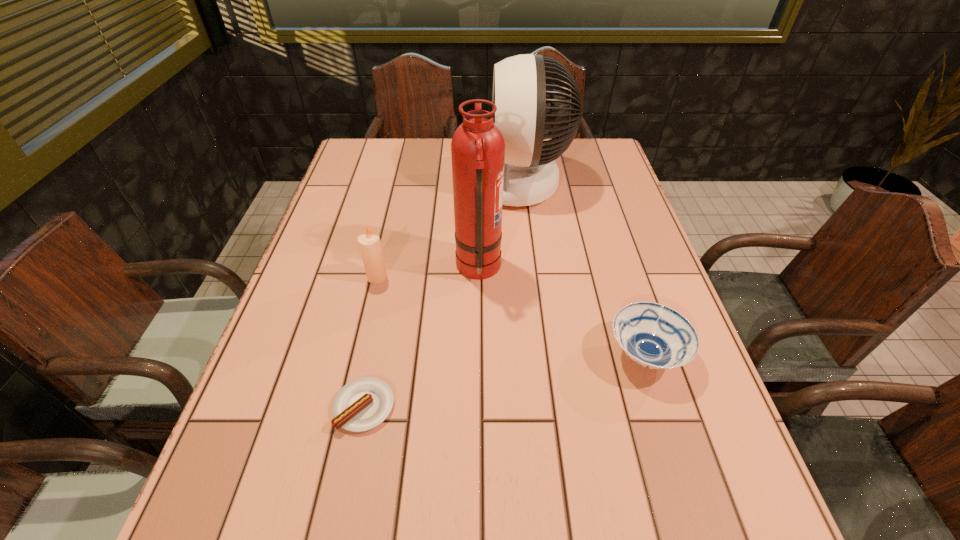
Locate an element on the screen. vacant space at the far right corner of the desktop is located at coordinates (622, 177).

Where is `vacant area that lies between the shortest object and the farthest object`? The image size is (960, 540). vacant area that lies between the shortest object and the farthest object is located at coordinates (442, 295).

I want to click on empty location between the farthest object and the shortest object, so click(442, 295).

Locate an element on the screen. free space between the sausage and the third shortest object is located at coordinates (371, 342).

Identify the location of vacant region between the soup bowl and the farthest object. The image size is (960, 540). (583, 269).

Find the location of a particular element. This screenshot has width=960, height=540. free space between the soup bowl and the farthest object is located at coordinates (583, 269).

Identify the location of blank region between the candle and the fire extinguisher. The width and height of the screenshot is (960, 540). (428, 273).

What are the coordinates of `free spot between the fan and the candle` in the screenshot? It's located at (448, 231).

Where is `object that is the nearest to the fan`? This screenshot has height=540, width=960. object that is the nearest to the fan is located at coordinates (478, 148).

Identify which object is the closest to the shortest object. Please provide its 2D coordinates. Your answer should be formatted as a tuple, i.e. [(x, y)], where the tuple contains the x and y coordinates of a point satisfying the conditions above.

[(370, 247)]